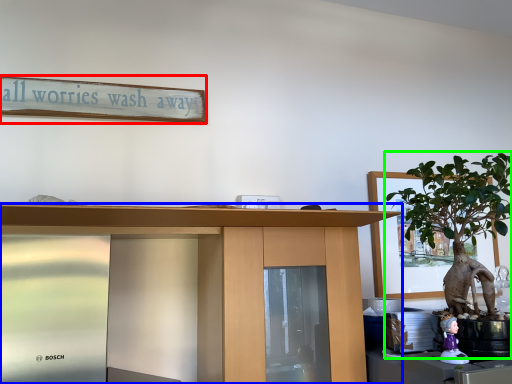
Question: Estimate the real-world distances between objects in this image. Which object is closer to bulletin board (highlighted by a red box), desk (highlighted by a blue box) or houseplant (highlighted by a green box)?

Choices:
 (A) desk
 (B) houseplant

Answer: (A)